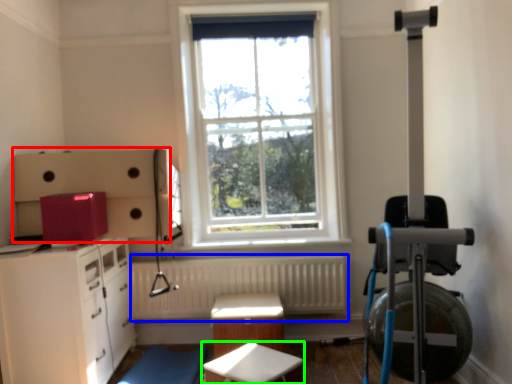
Question: Which object is the closest to the cabinetry (highlighted by a red box)? Choose among these: radiator (highlighted by a blue box) or table (highlighted by a green box).

Choices:
 (A) radiator
 (B) table

Answer: (A)